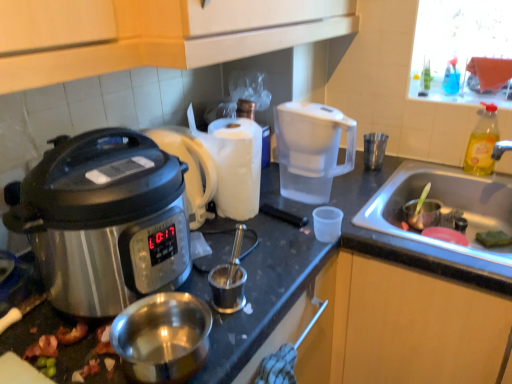
Image resolution: width=512 pixels, height=384 pixels. I want to click on metallic silver cup at right, the 2th coffee cup in the left-to-right sequence, so click(374, 150).

Image resolution: width=512 pixels, height=384 pixels. I want to click on metallic silver cup at sink, marked as the second coffee cup in a bottom-to-top arrangement, so click(422, 214).

Identify the location of stainless steel sink at lower right. (444, 205).

Describe the element at coordinates (451, 77) in the screenshot. This screenshot has height=384, width=512. I see `blue translucent bottle at upper right, the 1th bottle in the top-to-bottom sequence` at that location.

Where is `transparent plastic water filter pitcher at center-right`? This screenshot has width=512, height=384. transparent plastic water filter pitcher at center-right is located at coordinates pyautogui.click(x=311, y=149).

Based on the photo, is shiny metallic bacon at lower left taller or shorter than yellow translucent bottle at sink right, marked as the 2th bottle in a top-to-bottom arrangement?

Clearly, shiny metallic bacon at lower left is shorter compared to yellow translucent bottle at sink right, marked as the 2th bottle in a top-to-bottom arrangement.

In terms of width, does shiny metallic bacon at lower left look wider or thinner when compared to yellow translucent bottle at sink right, acting as the first bottle starting from the bottom?

In the image, shiny metallic bacon at lower left appears to be wider than yellow translucent bottle at sink right, acting as the first bottle starting from the bottom.

From the picture: In the image, is shiny metallic bacon at lower left on the left side or the right side of yellow translucent bottle at sink right, acting as the first bottle starting from the bottom?

Based on their positions, shiny metallic bacon at lower left is located to the left of yellow translucent bottle at sink right, acting as the first bottle starting from the bottom.

Does shiny metallic bacon at lower left turn towards yellow translucent bottle at sink right, marked as the 2th bottle in a top-to-bottom arrangement?

No, shiny metallic bacon at lower left does not turn towards yellow translucent bottle at sink right, marked as the 2th bottle in a top-to-bottom arrangement.

Would you say transparent plastic cup at center, which is the 3th coffee cup in back-to-front order, is inside or outside metallic silver cup at sink, marked as the 2th coffee cup in a top-to-bottom arrangement?

transparent plastic cup at center, which is the 3th coffee cup in back-to-front order, is outside metallic silver cup at sink, marked as the 2th coffee cup in a top-to-bottom arrangement.

Which of these two, transparent plastic cup at center, which is the 3th coffee cup in back-to-front order, or metallic silver cup at sink, which is the 2th coffee cup from back to front, is bigger?

With larger size is metallic silver cup at sink, which is the 2th coffee cup from back to front.

Is transparent plastic cup at center, which is counted as the 3th coffee cup, starting from the top, not close to metallic silver cup at sink, which ranks as the second coffee cup in front-to-back order?

Actually, transparent plastic cup at center, which is counted as the 3th coffee cup, starting from the top, and metallic silver cup at sink, which ranks as the second coffee cup in front-to-back order, are a little close together.

Who is shorter, transparent plastic cup at center, the 1th coffee cup when ordered from left to right, or metallic silver cup at sink, which ranks as the second coffee cup in front-to-back order?

transparent plastic cup at center, the 1th coffee cup when ordered from left to right.

Is metallic silver cup at right, positioned as the first coffee cup in back-to-front order, behind stainless steel slow cooker at left?

Yes, it is behind stainless steel slow cooker at left.

From the image's perspective, is metallic silver cup at right, the 2th coffee cup in the left-to-right sequence, located beneath stainless steel slow cooker at left?

Actually, metallic silver cup at right, the 2th coffee cup in the left-to-right sequence, appears above stainless steel slow cooker at left in the image.

From their relative heights in the image, would you say metallic silver cup at right, the 3th coffee cup positioned from the front, is taller or shorter than stainless steel slow cooker at left?

Clearly, metallic silver cup at right, the 3th coffee cup positioned from the front, is shorter compared to stainless steel slow cooker at left.

Looking at this image, considering the relative positions of shiny silver pot at lower left and stainless steel sink at lower right in the image provided, is shiny silver pot at lower left to the left or to the right of stainless steel sink at lower right?

Clearly, shiny silver pot at lower left is on the left of stainless steel sink at lower right in the image.

Measure the distance from shiny silver pot at lower left to stainless steel sink at lower right.

They are 73.82 centimeters apart.

From the image's perspective, is shiny silver pot at lower left above or below stainless steel sink at lower right?

shiny silver pot at lower left is below stainless steel sink at lower right.

From a real-world perspective, is shiny silver pot at lower left above or below stainless steel sink at lower right?

From a real-world perspective, shiny silver pot at lower left is physically above stainless steel sink at lower right.

Can you confirm if metallic silver cup at sink, which is the 2th coffee cup from back to front, is positioned to the left of wooden cabinet at lower right?

Indeed, metallic silver cup at sink, which is the 2th coffee cup from back to front, is positioned on the left side of wooden cabinet at lower right.

In the image, is metallic silver cup at sink, which is the third coffee cup from left to right, positioned in front of or behind wooden cabinet at lower right?

metallic silver cup at sink, which is the third coffee cup from left to right, is positioned farther from the viewer than wooden cabinet at lower right.

Who is taller, metallic silver cup at sink, marked as the 2th coffee cup in a top-to-bottom arrangement, or wooden cabinet at lower right?

wooden cabinet at lower right.

The width and height of the screenshot is (512, 384). There is a wooden cabinet at lower right. In order to click on the 2nd coffee cup above it (from the image's perspective) in this screenshot , I will do `click(422, 214)`.

How many degrees apart are the facing directions of yellow translucent bottle at sink right, marked as the 2th bottle in a top-to-bottom arrangement, and stainless steel sink at lower right?

The angular difference between yellow translucent bottle at sink right, marked as the 2th bottle in a top-to-bottom arrangement, and stainless steel sink at lower right is 0.972 degrees.

Does yellow translucent bottle at sink right, marked as the 2th bottle in a top-to-bottom arrangement, have a lesser width compared to stainless steel sink at lower right?

Correct, the width of yellow translucent bottle at sink right, marked as the 2th bottle in a top-to-bottom arrangement, is less than that of stainless steel sink at lower right.

Does yellow translucent bottle at sink right, marked as the 2th bottle in a top-to-bottom arrangement, lie in front of stainless steel sink at lower right?

No, yellow translucent bottle at sink right, marked as the 2th bottle in a top-to-bottom arrangement, is further to the viewer.

From a real-world perspective, is yellow translucent bottle at sink right, acting as the first bottle starting from the bottom, above or below stainless steel sink at lower right?

In terms of real-world spatial position, yellow translucent bottle at sink right, acting as the first bottle starting from the bottom, is above stainless steel sink at lower right.

Is stainless steel slow cooker at left situated inside yellow translucent bottle at sink right, marked as the 2th bottle in a top-to-bottom arrangement, or outside?

stainless steel slow cooker at left is outside yellow translucent bottle at sink right, marked as the 2th bottle in a top-to-bottom arrangement.

From a real-world perspective, relative to yellow translucent bottle at sink right, acting as the first bottle starting from the bottom, is stainless steel slow cooker at left vertically above or below?

In terms of real-world spatial position, stainless steel slow cooker at left is above yellow translucent bottle at sink right, acting as the first bottle starting from the bottom.

Can you confirm if stainless steel slow cooker at left is taller than yellow translucent bottle at sink right, acting as the first bottle starting from the bottom?

Yes, stainless steel slow cooker at left is taller than yellow translucent bottle at sink right, acting as the first bottle starting from the bottom.

Which is behind, point (94, 143) or point (482, 128)?

Positioned behind is point (482, 128).

Where is `bottle that is the 1st object located above the shiny metallic bacon at lower left (from the image's perspective)`? bottle that is the 1st object located above the shiny metallic bacon at lower left (from the image's perspective) is located at coordinates (482, 143).

The image size is (512, 384). In the image, there is a transparent plastic cup at center, the first coffee cup ordered from the bottom. Find the location of `coffee cup below it (from a real-world perspective)`. coffee cup below it (from a real-world perspective) is located at coordinates (422, 214).

Estimate the real-world distances between objects in this image. Which object is further from metallic silver cup at sink, which is the third coffee cup from left to right, stainless steel sink at lower right or metallic silver cup at right, the 2th coffee cup in the left-to-right sequence?

Among the two, metallic silver cup at right, the 2th coffee cup in the left-to-right sequence, is located further to metallic silver cup at sink, which is the third coffee cup from left to right.

Based on their spatial positions, is wooden cabinet at lower right or shiny metallic bacon at lower left further from metallic silver cup at right, the 3th coffee cup positioned from the front?

Based on the image, shiny metallic bacon at lower left appears to be further to metallic silver cup at right, the 3th coffee cup positioned from the front.

Which object lies further to the anchor point stainless steel slow cooker at left, shiny metallic bacon at lower left or blue translucent bottle at upper right, marked as the second bottle in a bottom-to-top arrangement?

blue translucent bottle at upper right, marked as the second bottle in a bottom-to-top arrangement.

Based on their spatial positions, is stainless steel slow cooker at left or yellow translucent bottle at sink right, marked as the 2th bottle in a top-to-bottom arrangement, closer to shiny silver pot at lower left?

stainless steel slow cooker at left is positioned closer to the anchor shiny silver pot at lower left.

Based on their spatial positions, is shiny metallic bacon at lower left or metallic silver cup at sink, which is the third coffee cup from left to right, further from yellow translucent bottle at sink right, acting as the first bottle starting from the bottom?

Among the two, shiny metallic bacon at lower left is located further to yellow translucent bottle at sink right, acting as the first bottle starting from the bottom.

In the scene shown: When comparing their distances from blue translucent bottle at upper right, the 1th bottle in the top-to-bottom sequence, does transparent plastic water filter pitcher at center-right or stainless steel sink at lower right seem closer?

Among the two, stainless steel sink at lower right is located nearer to blue translucent bottle at upper right, the 1th bottle in the top-to-bottom sequence.

Considering their positions, is transparent plastic water filter pitcher at center-right positioned closer to blue translucent bottle at upper right, the 1th bottle in the top-to-bottom sequence, than yellow translucent bottle at sink right, marked as the 2th bottle in a top-to-bottom arrangement?

yellow translucent bottle at sink right, marked as the 2th bottle in a top-to-bottom arrangement, is closer to blue translucent bottle at upper right, the 1th bottle in the top-to-bottom sequence.

When comparing their distances from metallic silver cup at right, positioned as the first coffee cup in back-to-front order, does shiny metallic bacon at lower left or metallic silver cup at sink, marked as the second coffee cup in a bottom-to-top arrangement, seem closer?

The object closer to metallic silver cup at right, positioned as the first coffee cup in back-to-front order, is metallic silver cup at sink, marked as the second coffee cup in a bottom-to-top arrangement.

Find the location of `sink between shiny metallic bacon at lower left and blue translucent bottle at upper right, marked as the second bottle in a bottom-to-top arrangement`. sink between shiny metallic bacon at lower left and blue translucent bottle at upper right, marked as the second bottle in a bottom-to-top arrangement is located at coordinates (444, 205).

Find the location of a particular element. sink between transparent plastic water filter pitcher at center-right and wooden cabinet at lower right in the up-down direction is located at coordinates (444, 205).

I want to click on slow cooker between shiny metallic bacon at lower left and transparent plastic cup at center, the 1th coffee cup when ordered from left to right, so click(x=104, y=220).

Identify the location of coffee maker situated between stainless steel slow cooker at left and blue translucent bottle at upper right, the 1th bottle in the top-to-bottom sequence, from left to right. The height and width of the screenshot is (384, 512). (311, 149).